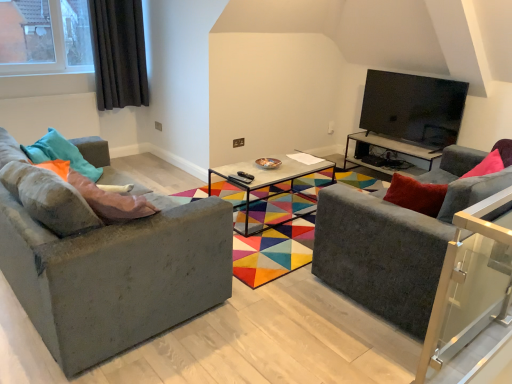
What do you see at coordinates (111, 201) in the screenshot? Image resolution: width=512 pixels, height=384 pixels. I see `pink fabric pillow at left, the 2th pillow when ordered from left to right` at bounding box center [111, 201].

What is the approximate width of pink fabric pillow at left, acting as the 1th pillow starting from the right?

The width of pink fabric pillow at left, acting as the 1th pillow starting from the right, is 11.07 inches.

The image size is (512, 384). Describe the element at coordinates (108, 265) in the screenshot. I see `textured gray couch at left, which ranks as the second studio couch in right-to-left order` at that location.

In order to face metallic black coffee table at center, should I rotate leftwards or rightwards?

You should rotate right by 18.385 degrees.

This screenshot has width=512, height=384. I want to click on metallic black coffee table at center, so click(392, 152).

What do you see at coordinates (269, 185) in the screenshot? The image size is (512, 384). I see `concrete textured coffee table at center` at bounding box center [269, 185].

What is the approximate width of teal fabric pillow at left, the 1th pillow positioned from the left?

It is 10.68 inches.

Locate an element on the screen. The image size is (512, 384). dark grey fabric curtain at upper left is located at coordinates (118, 53).

Do you think black glossy tv at upper right is within textured gray couch at left, acting as the first studio couch starting from the left, or outside of it?

black glossy tv at upper right lies outside textured gray couch at left, acting as the first studio couch starting from the left.

From the image's perspective, who appears lower, black glossy tv at upper right or textured gray couch at left, which ranks as the second studio couch in right-to-left order?

textured gray couch at left, which ranks as the second studio couch in right-to-left order, appears lower in the image.

What's the angular difference between black glossy tv at upper right and textured gray couch at left, which ranks as the second studio couch in right-to-left order,'s facing directions?

black glossy tv at upper right and textured gray couch at left, which ranks as the second studio couch in right-to-left order, are facing 177 degrees away from each other.

Considering the relative sizes of black glossy tv at upper right and textured gray couch at left, which ranks as the second studio couch in right-to-left order, in the image provided, is black glossy tv at upper right smaller than textured gray couch at left, which ranks as the second studio couch in right-to-left order,?

Yes, black glossy tv at upper right is smaller than textured gray couch at left, which ranks as the second studio couch in right-to-left order.

Considering the sizes of dark gray fabric couch at right, acting as the first studio couch starting from the right, and dark grey fabric curtain at upper left in the image, is dark gray fabric couch at right, acting as the first studio couch starting from the right, taller or shorter than dark grey fabric curtain at upper left?

In the image, dark gray fabric couch at right, acting as the first studio couch starting from the right, appears to be shorter than dark grey fabric curtain at upper left.

Would you say dark gray fabric couch at right, placed as the second studio couch when sorted from left to right, is inside or outside dark grey fabric curtain at upper left?

dark gray fabric couch at right, placed as the second studio couch when sorted from left to right, is not enclosed by dark grey fabric curtain at upper left.

Considering the relative positions of dark gray fabric couch at right, placed as the second studio couch when sorted from left to right, and dark grey fabric curtain at upper left in the image provided, is dark gray fabric couch at right, placed as the second studio couch when sorted from left to right, to the right of dark grey fabric curtain at upper left from the viewer's perspective?

Indeed, dark gray fabric couch at right, placed as the second studio couch when sorted from left to right, is positioned on the right side of dark grey fabric curtain at upper left.

Is dark gray fabric couch at right, placed as the second studio couch when sorted from left to right, far away from dark grey fabric curtain at upper left?

Absolutely, dark gray fabric couch at right, placed as the second studio couch when sorted from left to right, is distant from dark grey fabric curtain at upper left.

Considering the positions of points (398, 133) and (331, 211), is point (398, 133) farther from camera compared to point (331, 211)?

Yes, point (398, 133) is farther from viewer.

Measure the distance from black glossy tv at upper right to dark gray fabric couch at right, acting as the first studio couch starting from the right.

They are 7.00 feet apart.

Considering the relative positions of black glossy tv at upper right and dark gray fabric couch at right, acting as the first studio couch starting from the right, in the image provided, is black glossy tv at upper right to the right of dark gray fabric couch at right, acting as the first studio couch starting from the right, from the viewer's perspective?

Yes, black glossy tv at upper right is to the right of dark gray fabric couch at right, acting as the first studio couch starting from the right.

From a real-world perspective, is black glossy tv at upper right over dark gray fabric couch at right, acting as the first studio couch starting from the right?

Yes, from a real-world perspective, black glossy tv at upper right is on top of dark gray fabric couch at right, acting as the first studio couch starting from the right.

You are a GUI agent. You are given a task and a screenshot of the screen. Output one action in this format:
    pyautogui.click(x=<x>, y=<y>)
    Task: Click on the studio couch above the dark gray fabric couch at right, acting as the first studio couch starting from the right (from the image's perspective)
    The height and width of the screenshot is (384, 512).
    Given the screenshot: What is the action you would take?
    pyautogui.click(x=108, y=265)

Is textured gray couch at left, which ranks as the second studio couch in right-to-left order, inside or outside of dark gray fabric couch at right, placed as the second studio couch when sorted from left to right?

The correct answer is: outside.

In the scene shown: Can you confirm if textured gray couch at left, acting as the first studio couch starting from the left, is bigger than dark gray fabric couch at right, acting as the first studio couch starting from the right?

Actually, textured gray couch at left, acting as the first studio couch starting from the left, might be smaller than dark gray fabric couch at right, acting as the first studio couch starting from the right.

From the image's perspective, is textured gray couch at left, which ranks as the second studio couch in right-to-left order, located above or below dark gray fabric couch at right, acting as the first studio couch starting from the right?

Based on their image positions, textured gray couch at left, which ranks as the second studio couch in right-to-left order, is located above dark gray fabric couch at right, acting as the first studio couch starting from the right.

From a real-world perspective, is concrete textured coffee table at center located higher than teal fabric pillow at left, the 1th pillow positioned from the left?

Actually, concrete textured coffee table at center is physically below teal fabric pillow at left, the 1th pillow positioned from the left, in the real world.

Is concrete textured coffee table at center facing towards teal fabric pillow at left, which is the second pillow in right-to-left order?

Yes, concrete textured coffee table at center is aimed at teal fabric pillow at left, which is the second pillow in right-to-left order.

Is concrete textured coffee table at center further to the viewer compared to teal fabric pillow at left, which is the second pillow in right-to-left order?

Yes.

How far apart are concrete textured coffee table at center and teal fabric pillow at left, which is the second pillow in right-to-left order?

concrete textured coffee table at center and teal fabric pillow at left, which is the second pillow in right-to-left order, are 4.39 feet apart from each other.

Where is `the 1st pillow counting from the left of the concrete textured coffee table at center`? the 1st pillow counting from the left of the concrete textured coffee table at center is located at coordinates [x=111, y=201].

From the picture: From a real-world perspective, is concrete textured coffee table at center under pink fabric pillow at left, acting as the 1th pillow starting from the right?

Yes, from a real-world perspective, concrete textured coffee table at center is under pink fabric pillow at left, acting as the 1th pillow starting from the right.

Can you confirm if concrete textured coffee table at center is smaller than pink fabric pillow at left, the 2th pillow when ordered from left to right?

Actually, concrete textured coffee table at center might be larger than pink fabric pillow at left, the 2th pillow when ordered from left to right.

Is pink fabric pillow at left, the 2th pillow when ordered from left to right, at the back of concrete textured coffee table at center?

No, pink fabric pillow at left, the 2th pillow when ordered from left to right, is not at the back of concrete textured coffee table at center.

From the image's perspective, is pink fabric pillow at left, the 2th pillow when ordered from left to right, above dark gray fabric couch at right, placed as the second studio couch when sorted from left to right?

Yes, from the image's perspective, pink fabric pillow at left, the 2th pillow when ordered from left to right, is over dark gray fabric couch at right, placed as the second studio couch when sorted from left to right.

Does pink fabric pillow at left, the 2th pillow when ordered from left to right, have a lesser height compared to dark gray fabric couch at right, acting as the first studio couch starting from the right?

Yes, pink fabric pillow at left, the 2th pillow when ordered from left to right, is shorter than dark gray fabric couch at right, acting as the first studio couch starting from the right.

Is point (118, 216) positioned before point (416, 312)?

Yes, it is.

Looking at this image, considering the relative positions of pink fabric pillow at left, the 2th pillow when ordered from left to right, and dark gray fabric couch at right, placed as the second studio couch when sorted from left to right, in the image provided, is pink fabric pillow at left, the 2th pillow when ordered from left to right, to the left of dark gray fabric couch at right, placed as the second studio couch when sorted from left to right, from the viewer's perspective?

Indeed, pink fabric pillow at left, the 2th pillow when ordered from left to right, is positioned on the left side of dark gray fabric couch at right, placed as the second studio couch when sorted from left to right.

Where is `television above the textured gray couch at left, which ranks as the second studio couch in right-to-left order (from a real-world perspective)`? The image size is (512, 384). television above the textured gray couch at left, which ranks as the second studio couch in right-to-left order (from a real-world perspective) is located at coordinates (413, 108).

I want to click on studio couch that is the 1st object located in front of the dark grey fabric curtain at upper left, so click(x=395, y=241).

From the image, which object appears to be farther from concrete textured coffee table at center, dark grey fabric curtain at upper left or dark gray fabric couch at right, placed as the second studio couch when sorted from left to right?

The object further to concrete textured coffee table at center is dark grey fabric curtain at upper left.

Which object lies further to the anchor point textured gray couch at left, which ranks as the second studio couch in right-to-left order, dark gray fabric couch at right, acting as the first studio couch starting from the right, or metallic black coffee table at center?

Based on the image, metallic black coffee table at center appears to be further to textured gray couch at left, which ranks as the second studio couch in right-to-left order.

From the image, which object appears to be nearer to pink fabric pillow at left, the 2th pillow when ordered from left to right, dark gray fabric couch at right, placed as the second studio couch when sorted from left to right, or black glossy tv at upper right?

Among the two, dark gray fabric couch at right, placed as the second studio couch when sorted from left to right, is located nearer to pink fabric pillow at left, the 2th pillow when ordered from left to right.

Based on their spatial positions, is dark grey fabric curtain at upper left or dark gray fabric couch at right, placed as the second studio couch when sorted from left to right, closer to textured gray couch at left, which ranks as the second studio couch in right-to-left order?

dark gray fabric couch at right, placed as the second studio couch when sorted from left to right, lies closer to textured gray couch at left, which ranks as the second studio couch in right-to-left order, than the other object.

From the picture: From the image, which object appears to be nearer to dark gray fabric couch at right, placed as the second studio couch when sorted from left to right, black glossy tv at upper right or dark grey fabric curtain at upper left?

Among the two, black glossy tv at upper right is located nearer to dark gray fabric couch at right, placed as the second studio couch when sorted from left to right.

Estimate the real-world distances between objects in this image. Which object is further from concrete textured coffee table at center, metallic black coffee table at center or textured gray couch at left, acting as the first studio couch starting from the left?

Among the two, textured gray couch at left, acting as the first studio couch starting from the left, is located further to concrete textured coffee table at center.

Considering their positions, is dark grey fabric curtain at upper left positioned further to metallic black coffee table at center than teal fabric pillow at left, the 1th pillow positioned from the left?

The object further to metallic black coffee table at center is teal fabric pillow at left, the 1th pillow positioned from the left.

From the image, which object appears to be nearer to teal fabric pillow at left, which is the second pillow in right-to-left order, black glossy tv at upper right or concrete textured coffee table at center?

Based on the image, concrete textured coffee table at center appears to be nearer to teal fabric pillow at left, which is the second pillow in right-to-left order.

Image resolution: width=512 pixels, height=384 pixels. Identify the location of pillow located between teal fabric pillow at left, the 1th pillow positioned from the left, and metallic black coffee table at center in the left-right direction. (111, 201).

Locate an element on the screen. pillow between textured gray couch at left, which ranks as the second studio couch in right-to-left order, and teal fabric pillow at left, which is the second pillow in right-to-left order, along the z-axis is located at coordinates (111, 201).

I want to click on coffee table located between pink fabric pillow at left, acting as the 1th pillow starting from the right, and dark gray fabric couch at right, placed as the second studio couch when sorted from left to right, in the left-right direction, so click(269, 185).

The height and width of the screenshot is (384, 512). I want to click on pillow between pink fabric pillow at left, acting as the 1th pillow starting from the right, and dark grey fabric curtain at upper left, along the z-axis, so click(x=61, y=154).